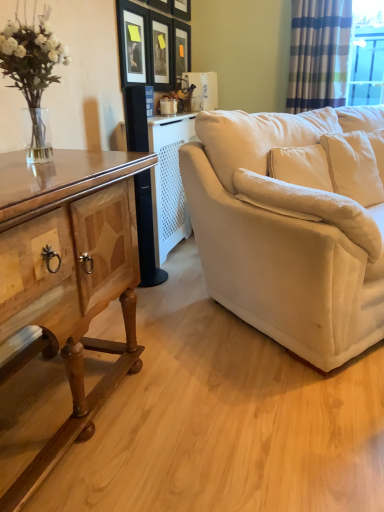
Question: Considering their positions, is matte black picture frame at upper center, which appears as the second picture frame when viewed from the right, located in front of or behind matte black picture frame at upper center, which is the third picture frame in right-to-left order?

Choices:
 (A) front
 (B) behind

Answer: (B)

Question: Choose the correct answer: Is matte black picture frame at upper center, acting as the 3th picture frame starting from the left, inside matte black picture frame at upper center, the second picture frame viewed from the left, or outside it?

Choices:
 (A) inside
 (B) outside

Answer: (B)

Question: Considering the real-world distances, which object is closest to the wooden picture frame at upper center, placed as the first picture frame when sorted from right to left?

Choices:
 (A) matte black picture frame at upper center, which is the third picture frame in right-to-left order
 (B) matte black picture frame at upper center, marked as the 1th picture frame in a left-to-right arrangement
 (C) velvet beige couch at right
 (D) matte black picture frame at upper center, acting as the 3th picture frame starting from the left
 (E) striped fabric curtain at upper right

Answer: (D)

Question: Based on their relative distances, which object is farther from the wooden picture frame at upper center, positioned as the 4th picture frame in left-to-right order?

Choices:
 (A) wooden cabinet at left
 (B) velvet beige couch at right
 (C) white soft cushion at right
 (D) matte black picture frame at upper center, which appears as the second picture frame when viewed from the right
 (E) white glossy coffee cup at center

Answer: (A)